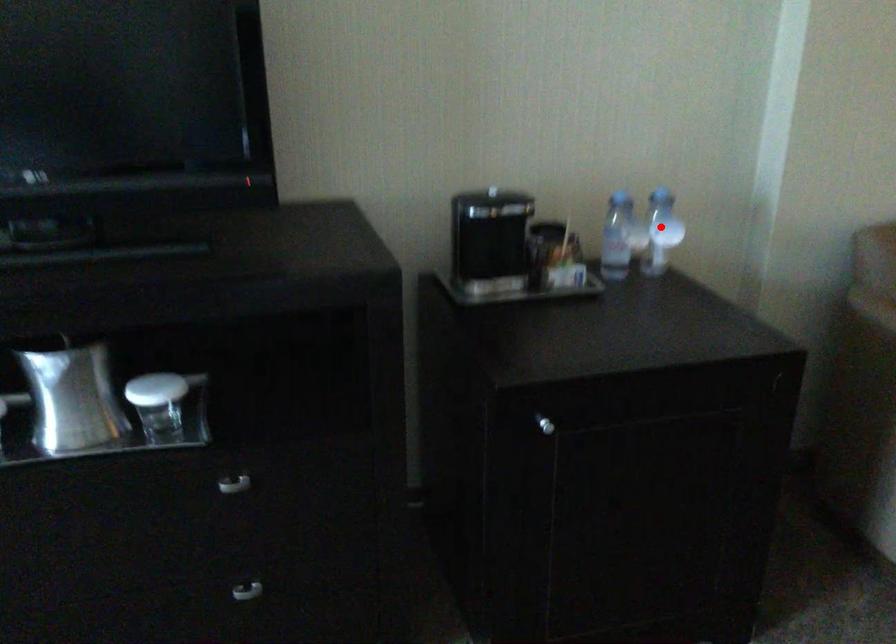
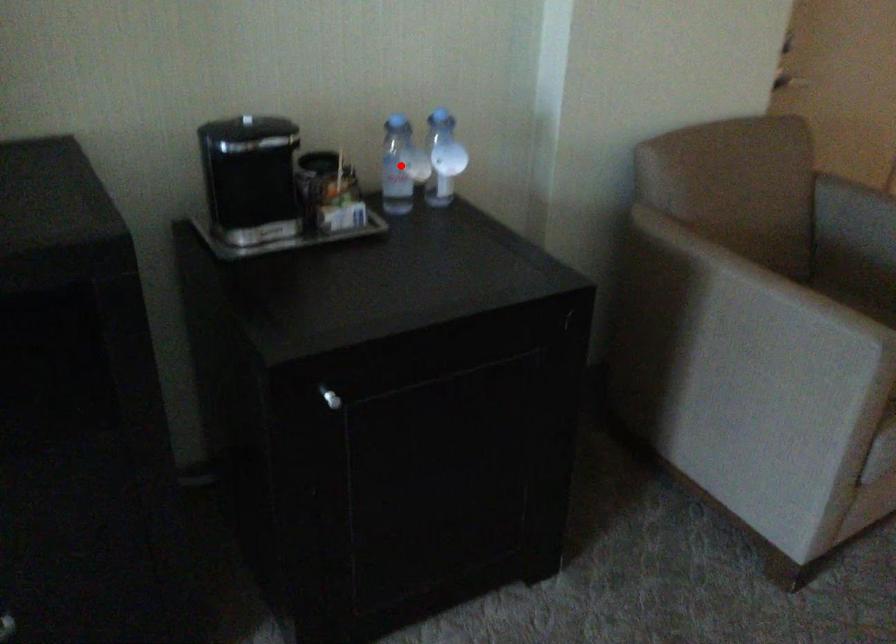
I am providing you with two images of the same scene from different viewpoints. A red point is marked on the first image and another point is marked on the second image. Does the point marked in image1 correspond to the same location as the one in image2?

No